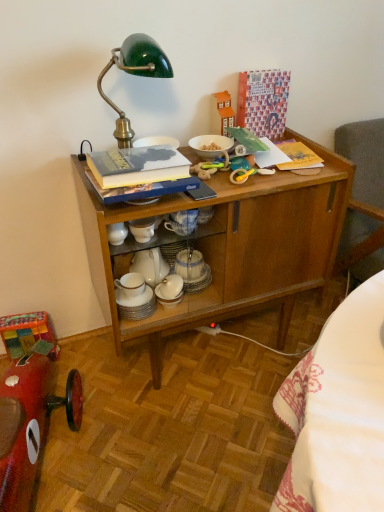
Locate an element on the screen. Image resolution: width=384 pixels, height=512 pixels. free space in front of wooden cabinet at center is located at coordinates (199, 438).